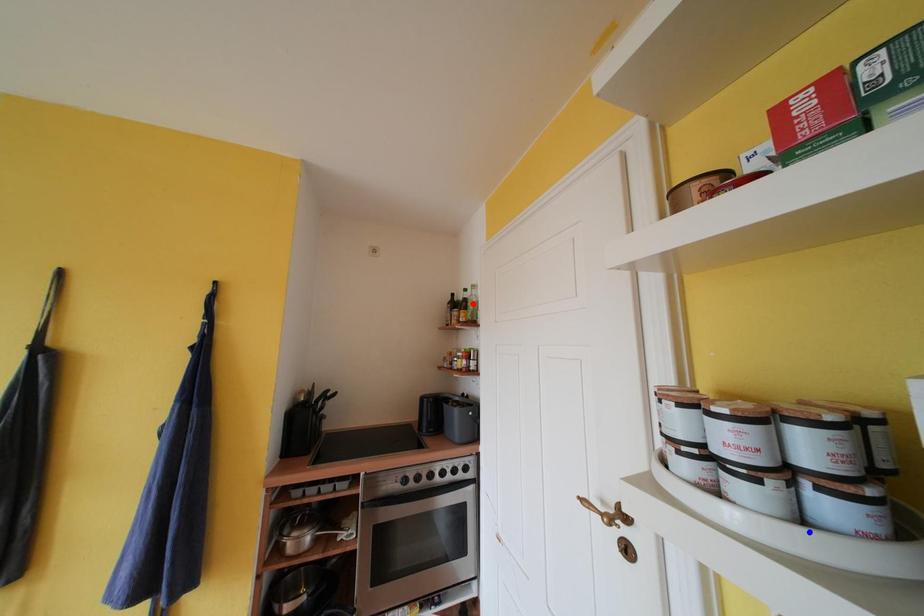
Question: Two points are marked on the image. Which point is closer to the camera?

Choices:
 (A) Blue point is closer.
 (B) Red point is closer.

Answer: (A)